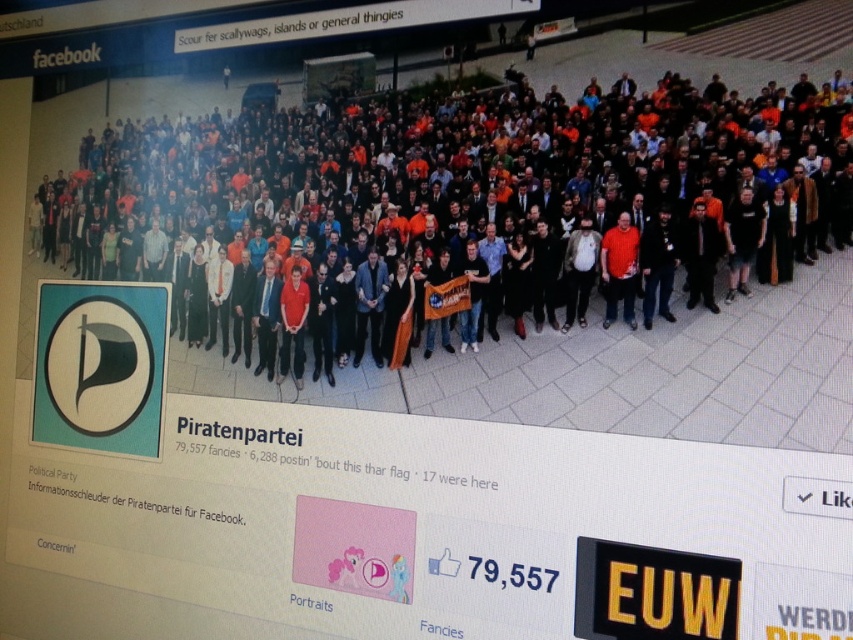
Question: Based on their relative distances, which object is nearer to the multicolored casual attire at center?

Choices:
 (A) black text at upper center
 (B) matte orange shirt at center

Answer: (B)

Question: Does multicolored casual attire at center appear on the left side of matte orange shirt at center?

Choices:
 (A) yes
 (B) no

Answer: (A)

Question: Is matte orange shirt at center behind black text at upper center?

Choices:
 (A) no
 (B) yes

Answer: (A)

Question: Can you confirm if matte orange shirt at center is positioned to the right of black text at upper center?

Choices:
 (A) no
 (B) yes

Answer: (B)

Question: Which point is closer to the camera?

Choices:
 (A) multicolored casual attire at center
 (B) black text at upper center

Answer: (A)

Question: Which of the following is the closest to the observer?

Choices:
 (A) (296, 435)
 (B) (625, 221)
 (C) (553, 173)

Answer: (B)